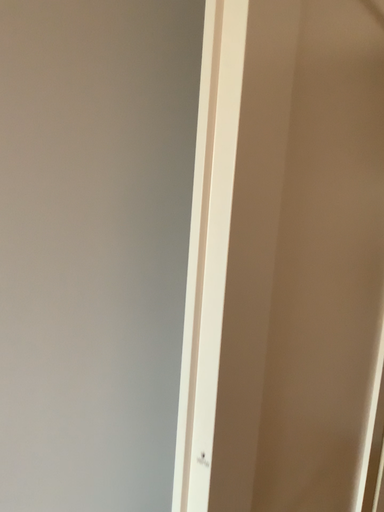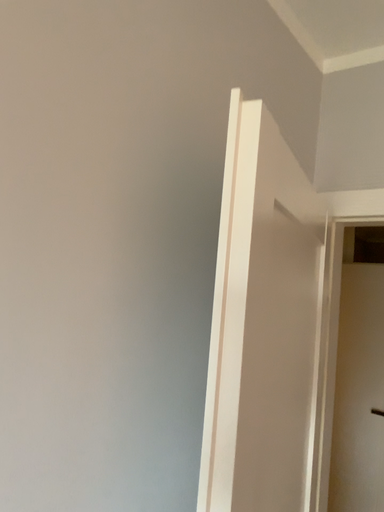
Question: How did the camera likely rotate when shooting the video?

Choices:
 (A) rotated left
 (B) rotated right

Answer: (B)